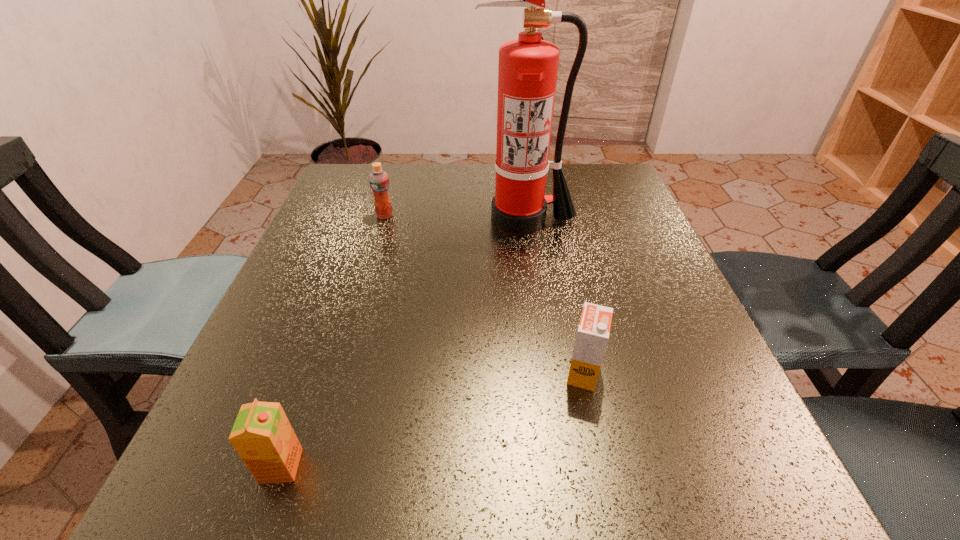
Find the location of `blank region between the second farthest orange juice and the fire extinguisher`. blank region between the second farthest orange juice and the fire extinguisher is located at coordinates (553, 296).

You are a GUI agent. You are given a task and a screenshot of the screen. Output one action in this format:
    pyautogui.click(x=<x>, y=<y>)
    Task: Click on the free spot between the farthest orange juice and the rightmost orange juice
    
    Given the screenshot: What is the action you would take?
    pyautogui.click(x=484, y=294)

What are the coordinates of `the closest object relative to the farthest orange juice` in the screenshot? It's located at (527, 71).

Identify which object is located as the nearest to the farthest orange juice. Please provide its 2D coordinates. Your answer should be formatted as a tuple, i.e. [(x, y)], where the tuple contains the x and y coordinates of a point satisfying the conditions above.

[(527, 71)]

At what (x,y) coordinates should I click in order to perform the action: click on orange juice that is the closest to the rightmost orange juice. Please return your answer as a coordinate pair (x, y). This screenshot has height=540, width=960. Looking at the image, I should click on (262, 435).

Find the location of a particular element. orange juice object that ranks as the closest to the farthest orange juice is located at coordinates (593, 332).

The width and height of the screenshot is (960, 540). Identify the location of vacant area that satisfies the following two spatial constraints: 1. at the nozzle of the fire extinguisher; 2. on the right side of the rightmost orange juice. (542, 373).

This screenshot has height=540, width=960. Find the location of `vacant space that satisfies the following two spatial constraints: 1. at the nozzle of the fire extinguisher; 2. on the right side of the rightmost orange juice`. vacant space that satisfies the following two spatial constraints: 1. at the nozzle of the fire extinguisher; 2. on the right side of the rightmost orange juice is located at coordinates (542, 373).

Image resolution: width=960 pixels, height=540 pixels. Identify the location of vacant area in the image that satisfies the following two spatial constraints: 1. on the front side of the second nearest orange juice; 2. on the right side of the farthest orange juice. (339, 373).